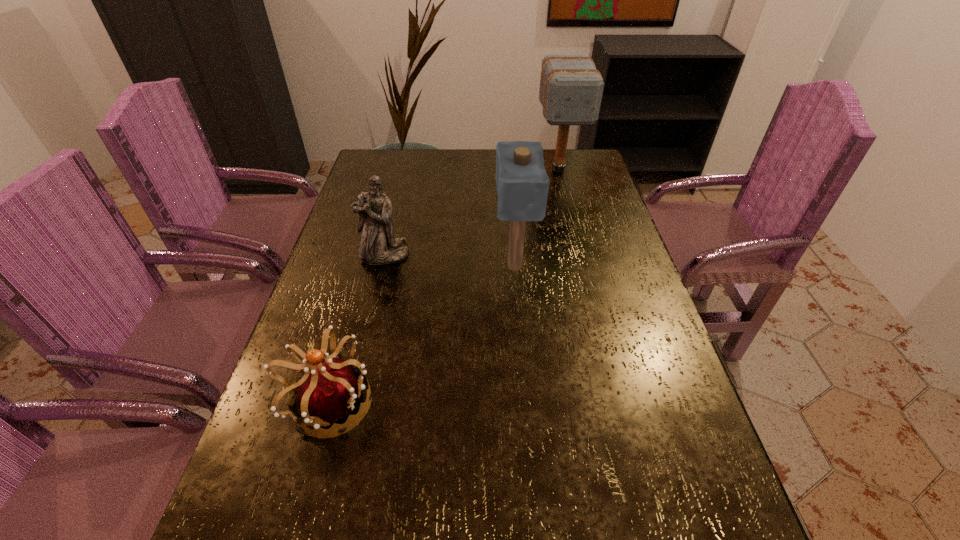
This screenshot has height=540, width=960. What are the coordinates of `vacant point located 0.370m on the front-facing side of the tiara` in the screenshot? It's located at click(x=562, y=403).

Find the location of a particular element. object located in the far edge section of the desktop is located at coordinates (571, 87).

Where is `figurine that is at the left edge`? The image size is (960, 540). figurine that is at the left edge is located at coordinates (378, 246).

Locate an element on the screen. This screenshot has height=540, width=960. tiara at the left edge is located at coordinates (328, 391).

Find the location of a particular element. The image size is (960, 540). object located at the right edge is located at coordinates (571, 87).

At what (x,y) coordinates should I click in order to perform the action: click on object that is positioned at the far right corner. Please return your answer as a coordinate pair (x, y). The image size is (960, 540). Looking at the image, I should click on (571, 87).

In the image, there is a desktop. Identify the location of free region at the far edge. (438, 164).

Where is `free space at the left edge of the desktop`? The width and height of the screenshot is (960, 540). free space at the left edge of the desktop is located at coordinates (344, 419).

Identify the location of free space at the right edge of the desktop. This screenshot has width=960, height=540. (618, 421).

Image resolution: width=960 pixels, height=540 pixels. I want to click on free spot at the far left corner of the desktop, so click(383, 152).